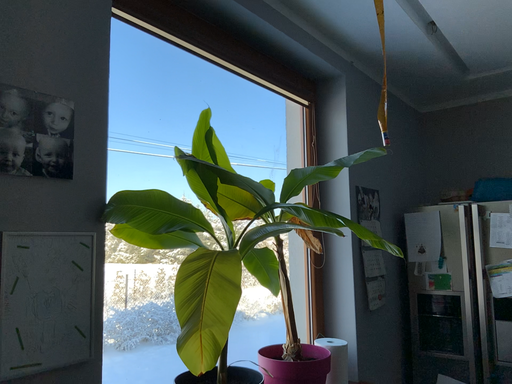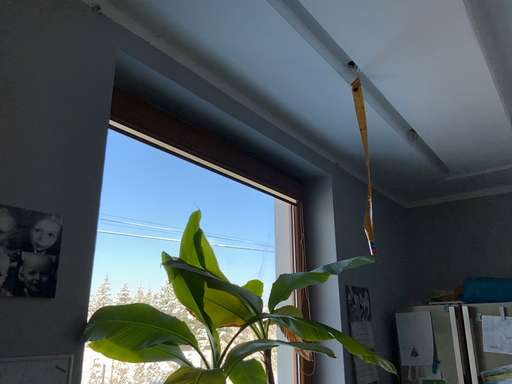
Question: How did the camera likely rotate when shooting the video?

Choices:
 (A) rotated downward
 (B) rotated upward

Answer: (B)